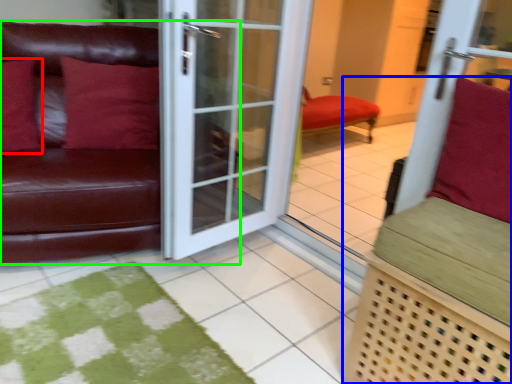
Question: Which object is positioned closest to pillow (highlighted by a red box)? Select from furniture (highlighted by a blue box) and studio couch (highlighted by a green box).

Choices:
 (A) furniture
 (B) studio couch

Answer: (B)